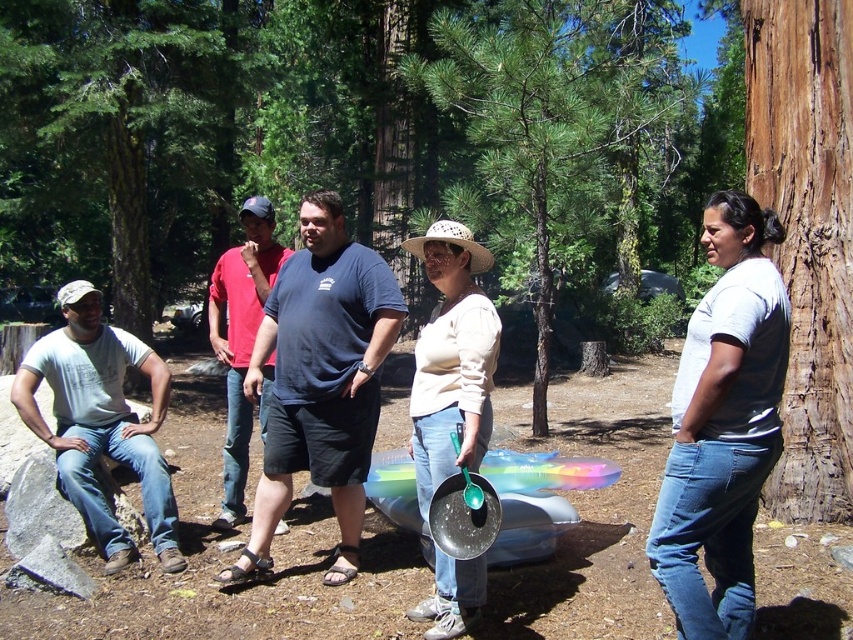
You are navigating a forest trail and need to locate the green rough bark tree at left. What are its coordinates?

The green rough bark tree at left is located at coordinates point (102, 134).

In the scene shown: You are planning to place a bench between the green rough bark tree at left and the brown rough bark at right. Given that the bench requires 1.2 meters of space, can the area between them accommodate it?

The green rough bark tree at left is wider than the brown rough bark at right. Since the bench requires 1.2 meters of space, the area between them can accommodate it as the trees are spaced sufficiently apart.

You are a hiker trying to navigate through the forest. You see the green rough bark tree at left and the brown rough bark at right. Which direction should you go to stay on the path that is closer to the trees with rough bark?

The green rough bark tree at left is positioned over brown rough bark at right, so staying closer to the brown rough bark at right would keep you on the path near the trees with rough bark.